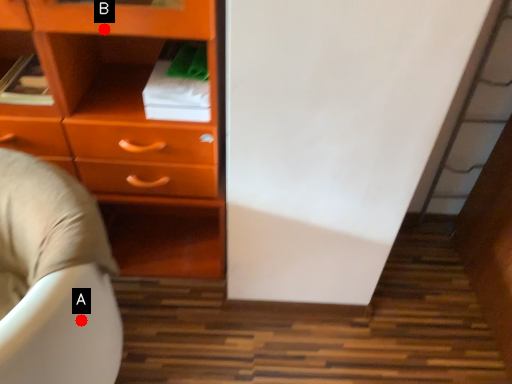
Question: Two points are circled on the image, labeled by A and B beside each circle. Which point is further to the camera?

Choices:
 (A) A is further
 (B) B is further

Answer: (B)